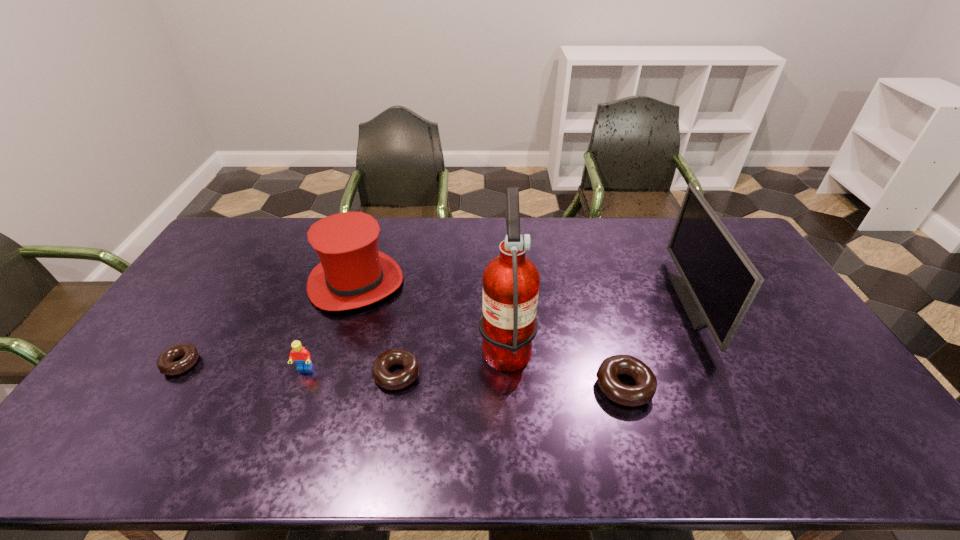
I want to click on the third tallest object, so click(353, 273).

This screenshot has height=540, width=960. Find the location of `Lego`. Lego is located at coordinates (301, 356).

You are a GUI agent. You are given a task and a screenshot of the screen. Output one action in this format:
    pyautogui.click(x=<x>, y=<y>)
    Task: Click on the blank area located 0.220m on the back of the leftmost doughnut
    Image resolution: width=960 pixels, height=540 pixels.
    Given the screenshot: What is the action you would take?
    pyautogui.click(x=224, y=296)

Identify the location of vacant area situated on the left of the second shortest object. The image size is (960, 540). (289, 374).

You are a GUI agent. You are given a task and a screenshot of the screen. Output one action in this format:
    pyautogui.click(x=<x>, y=<y>)
    Task: Click on the blank area located 0.050m on the back of the second object from right to left
    
    Given the screenshot: What is the action you would take?
    pyautogui.click(x=613, y=350)

At what (x,y) coordinates should I click in order to perform the action: click on free space located 0.300m on the nozzle and handle of the fire extinguisher. Please return your answer as a coordinate pair (x, y). Looking at the image, I should click on 375,342.

The width and height of the screenshot is (960, 540). In order to click on vacant space located on the nozzle and handle of the fire extinguisher in this screenshot , I will do `click(431, 342)`.

Identify the location of blank area located 0.120m on the nozzle and handle of the fire extinguisher. The height and width of the screenshot is (540, 960). (438, 342).

Identify the location of free space located on the screen side of the rightmost object. (615, 302).

Find the location of a particular element. free point located 0.120m on the screen side of the rightmost object is located at coordinates (643, 302).